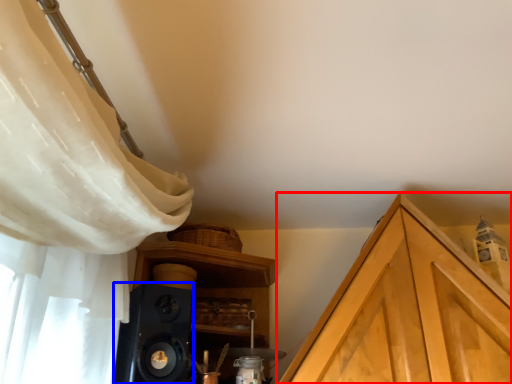
Question: Among these objects, which one is farthest to the camera, cabinetry (highlighted by a red box) or speaker (highlighted by a blue box)?

Choices:
 (A) cabinetry
 (B) speaker

Answer: (A)